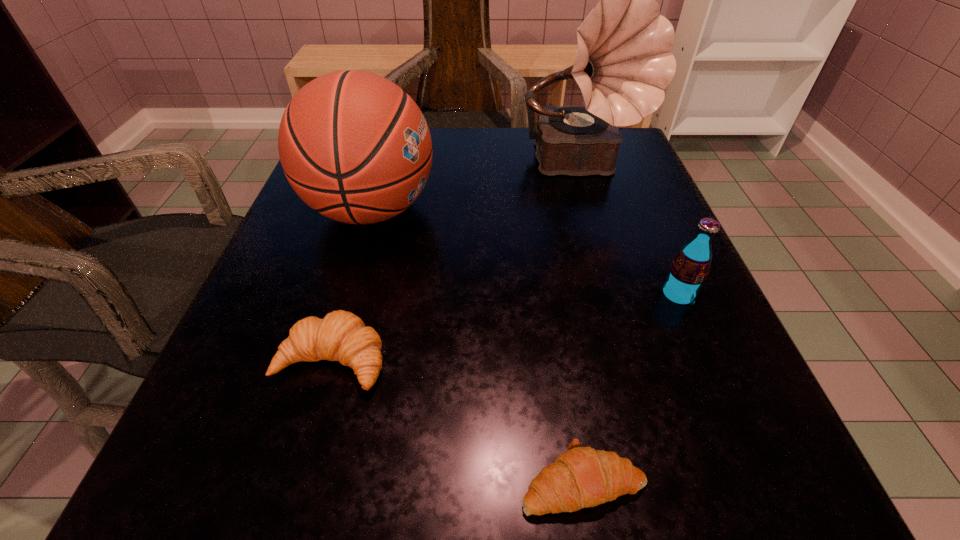
At what (x,y) coordinates should I click in order to perform the action: click on free space that is in between the tallest object and the shortest object. Please return your answer as a coordinate pair (x, y). The height and width of the screenshot is (540, 960). Looking at the image, I should click on (583, 324).

Image resolution: width=960 pixels, height=540 pixels. Identify the location of free area in between the nearer crescent roll and the soda. (630, 388).

In order to click on vacant space in between the taller crescent roll and the shortest object in this screenshot , I will do `click(458, 421)`.

Find the location of a particular element. empty space that is in between the third nearest object and the nearest object is located at coordinates (630, 388).

Where is `vacant space in between the nearer crescent roll and the record player`? The width and height of the screenshot is (960, 540). vacant space in between the nearer crescent roll and the record player is located at coordinates (583, 324).

Locate an element on the screen. The width and height of the screenshot is (960, 540). vacant area that lies between the second shortest object and the nearest object is located at coordinates (458, 421).

Identify which object is the second nearest to the tallest object. Please provide its 2D coordinates. Your answer should be formatted as a tuple, i.e. [(x, y)], where the tuple contains the x and y coordinates of a point satisfying the conditions above.

[(689, 270)]

What are the coordinates of `the second closest object to the left crescent roll` in the screenshot? It's located at (581, 477).

Find the location of a particular element. The image size is (960, 540). free space in the image that satisfies the following two spatial constraints: 1. on the logo side of the fourth shortest object; 2. on the back side of the second shortest object is located at coordinates (327, 360).

This screenshot has width=960, height=540. I want to click on free space that satisfies the following two spatial constraints: 1. on the logo side of the basketball; 2. on the right side of the taller crescent roll, so click(327, 360).